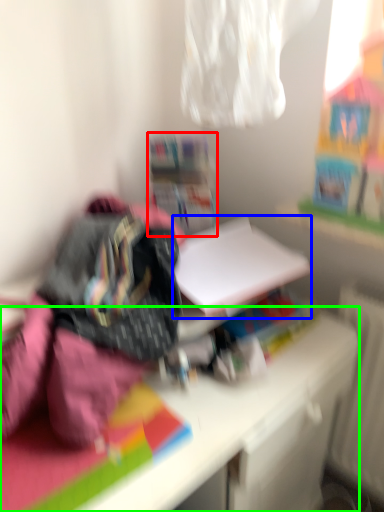
Question: Estimate the real-world distances between objects in this image. Which object is farther from shelf (highlighted by a red box), paperback book (highlighted by a blue box) or desk (highlighted by a green box)?

Choices:
 (A) paperback book
 (B) desk

Answer: (B)